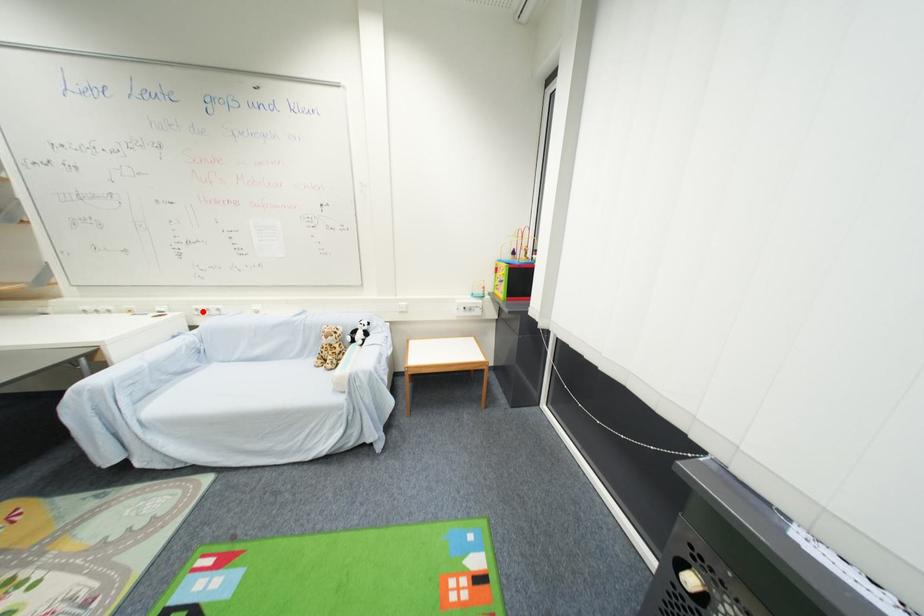
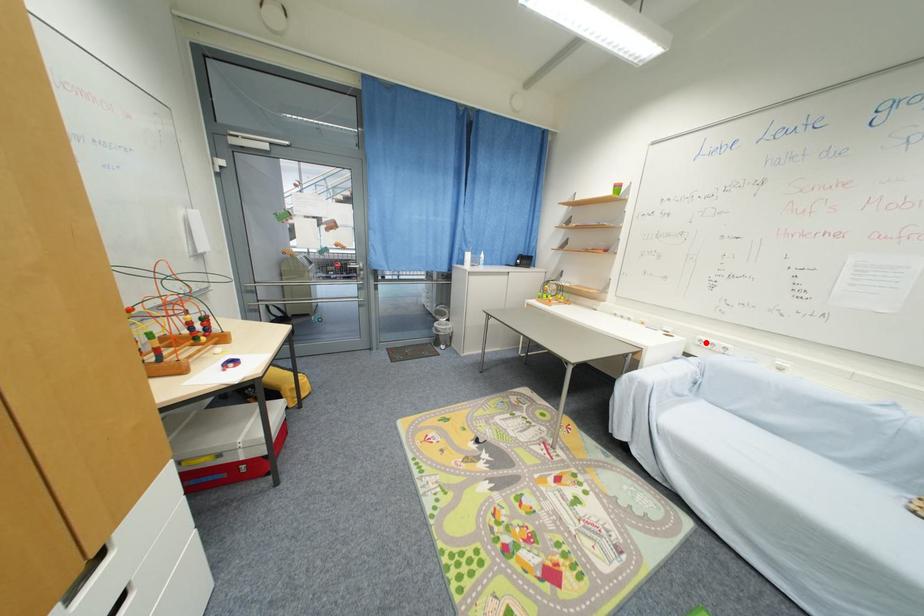
I am providing you with two images of the same scene from different viewpoints. A red point is marked on the first image and another point is marked on the second image. Is the red point in image1 aligned with the point shown in image2?

Yes